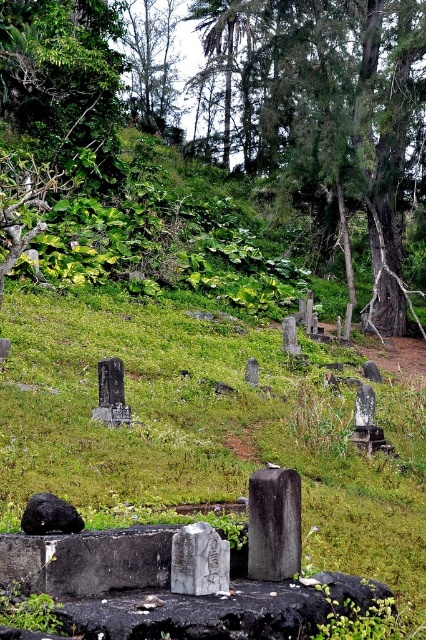
Based on the photo, you are standing in the cemetery and want to take a photo of the black polished stone gravestone at center without any obstructions. Is there a green leafy tree at upper center that might block your view?

The green leafy tree at upper center is much taller than the black polished stone gravestone at center, so it might block your view. You should move to a different angle or position to avoid the tree.

You are a visitor in the cemetery and want to take a photo of both the green leafy tree at upper center and the white marble gravestone at center. Since you want both to be in the frame, which object should you focus on to ensure both are visible?

You should focus on the white marble gravestone at center because the green leafy tree at upper center is larger in size than the white marble gravestone at center, so centering the smaller object allows both to fit within the frame.